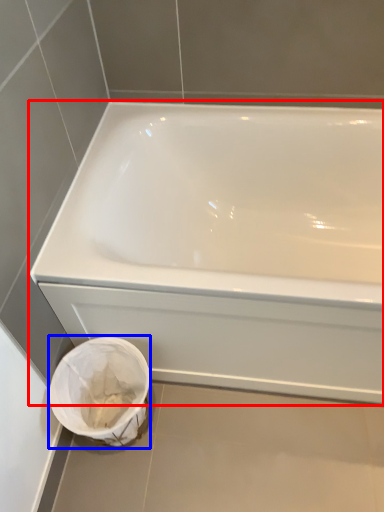
Question: Among these objects, which one is nearest to the camera, bathtub (highlighted by a red box) or porcelain (highlighted by a blue box)?

Choices:
 (A) bathtub
 (B) porcelain

Answer: (A)